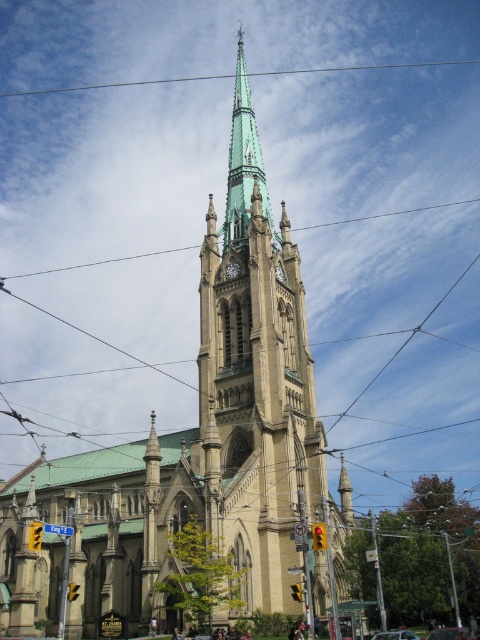
Between point (334, 68) and point (226, 273), which one is positioned in front?

Positioned in front is point (226, 273).

Between clear wire at upper center and white stone clock at center, which one has less height?

white stone clock at center

Who is more forward, (364, 67) or (233, 268)?

Point (233, 268) is more forward.

Where is `clear wire at upper center`? The height and width of the screenshot is (640, 480). clear wire at upper center is located at coordinates (238, 74).

Measure the distance between point (228, 154) and camera.

A distance of 132.40 meters exists between point (228, 154) and camera.

Is green glass spire at center behind green wire at upper center?

That is False.

Is point (247, 108) positioned behind point (377, 216)?

That is False.

I want to click on green glass spire at center, so click(x=243, y=163).

Is beige stone church at center to the left of clear wire at upper center from the viewer's perspective?

Indeed, beige stone church at center is positioned on the left side of clear wire at upper center.

Who is higher up, beige stone church at center or clear wire at upper center?

clear wire at upper center

Who is more forward, (176, 481) or (266, 72)?

Point (176, 481) is in front.

This screenshot has width=480, height=640. Identify the location of beige stone church at center. (196, 451).